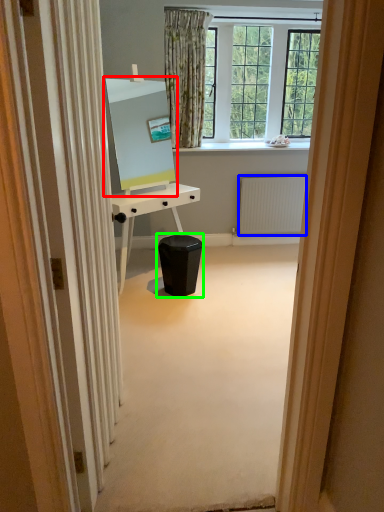
Question: Which object is the closest to the computer monitor (highlighted by a red box)? Choose among these: radiator (highlighted by a blue box) or music stool (highlighted by a green box).

Choices:
 (A) radiator
 (B) music stool

Answer: (B)